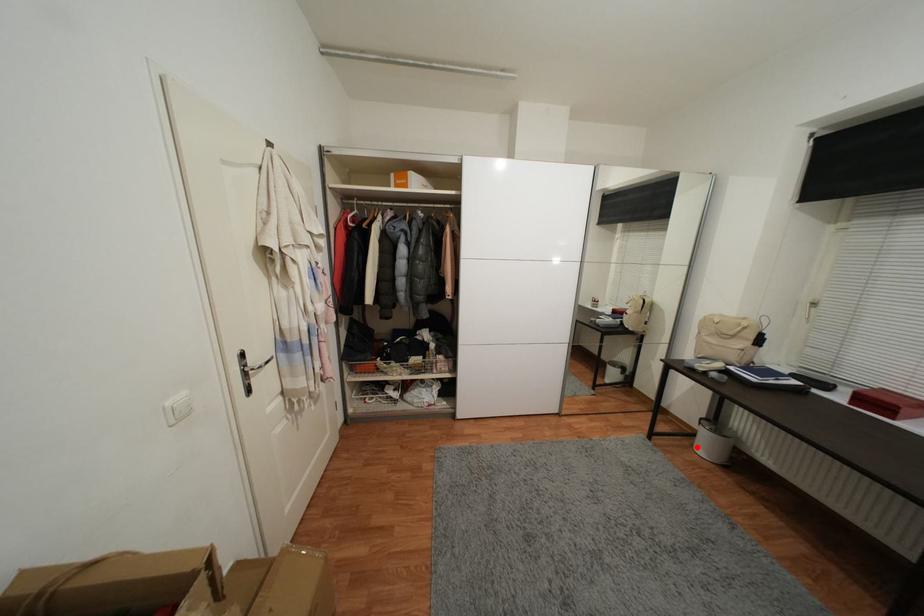
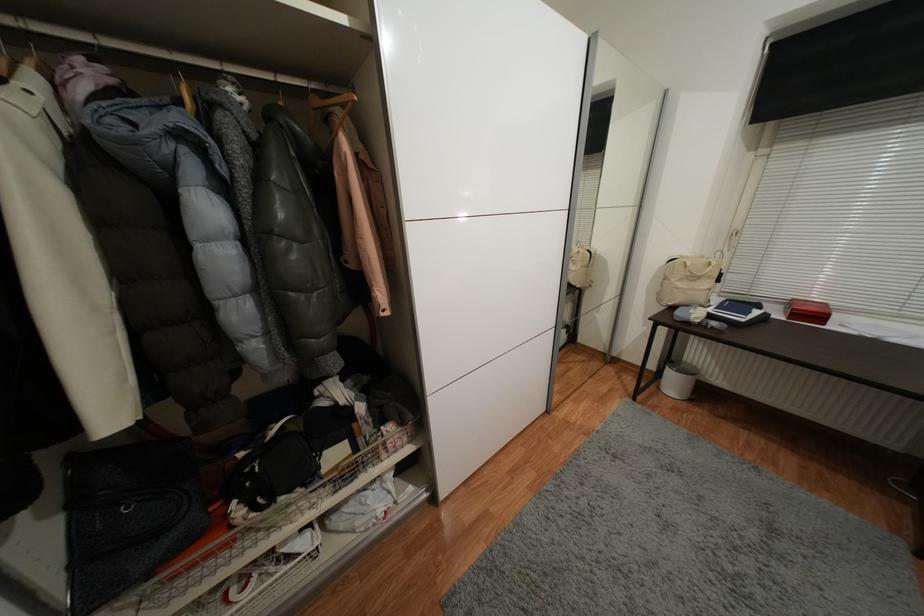
Question: I am providing you with two images of the same scene from different viewpoints. Given a red point in image1, look at the same physical point in image2. Is it:

Choices:
 (A) Closer to the viewpoint
 (B) Farther from the viewpoint

Answer: (B)